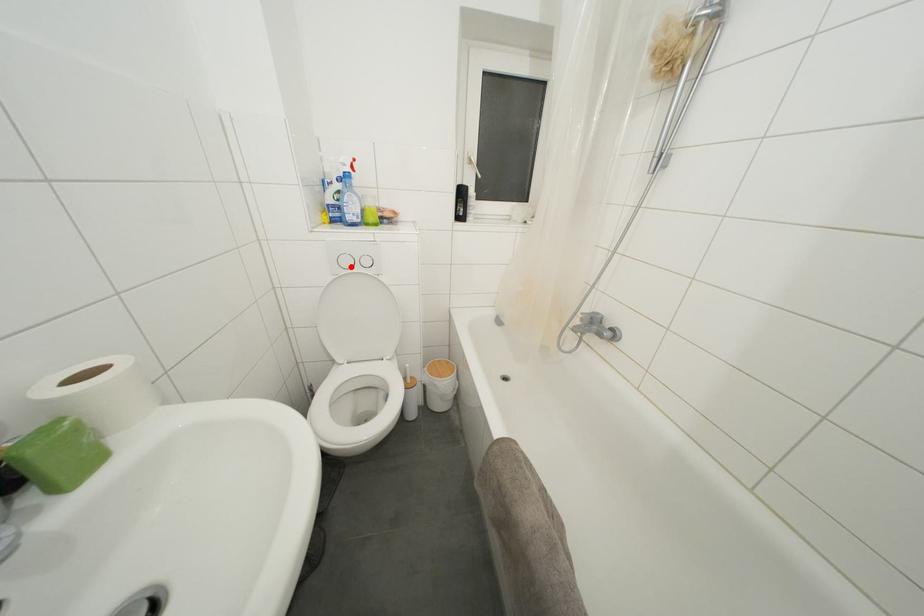
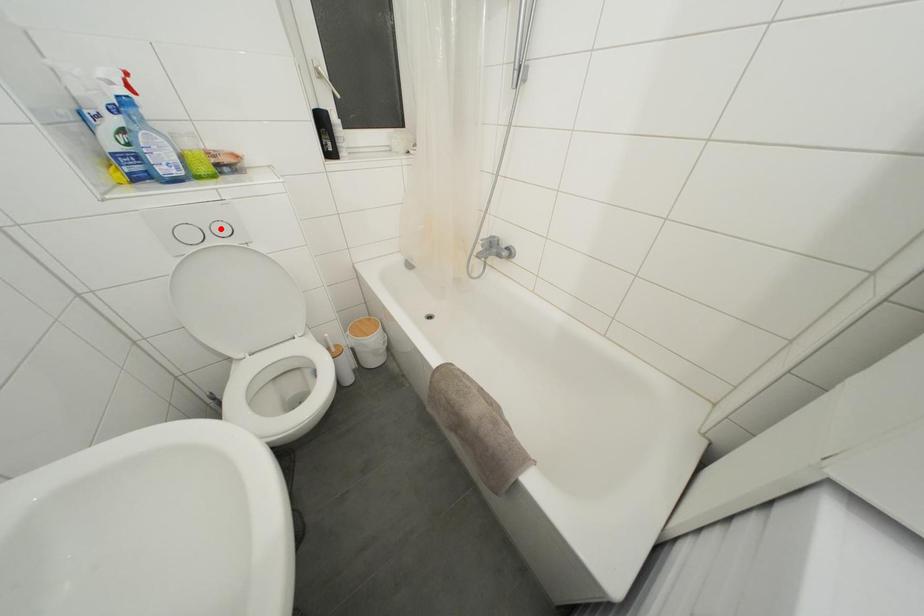
I am providing you with two images of the same scene from different viewpoints. A red point is marked on the first image and another point is marked on the second image. Are the points marked in image1 and image2 representing the same 3D position?

No